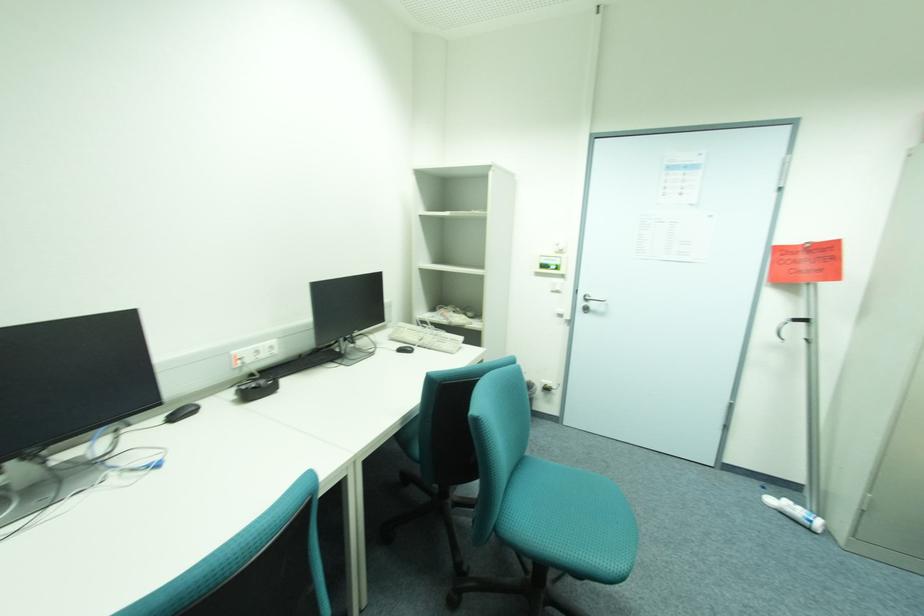
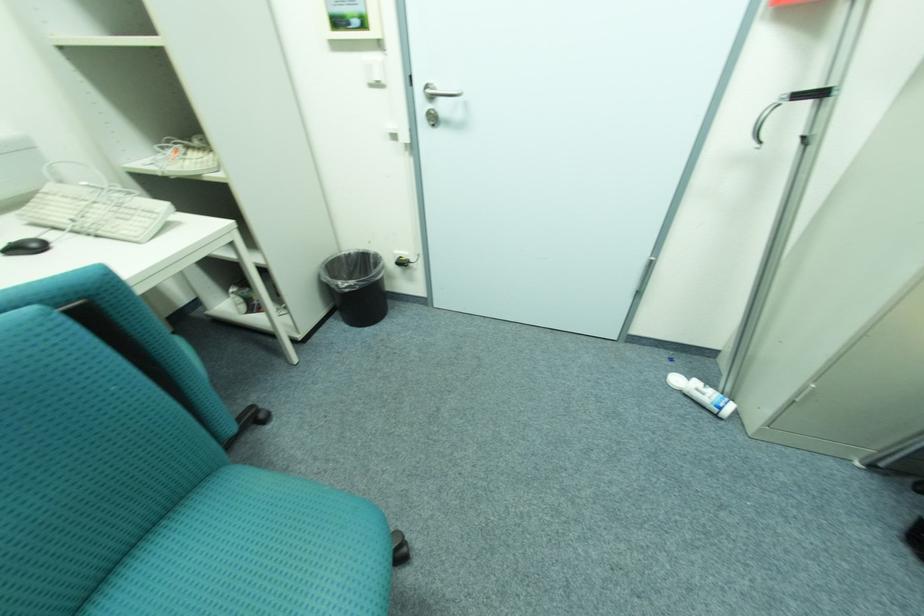
Locate, in the second image, the point that corresponds to point 426,347 in the first image.

(81, 233)